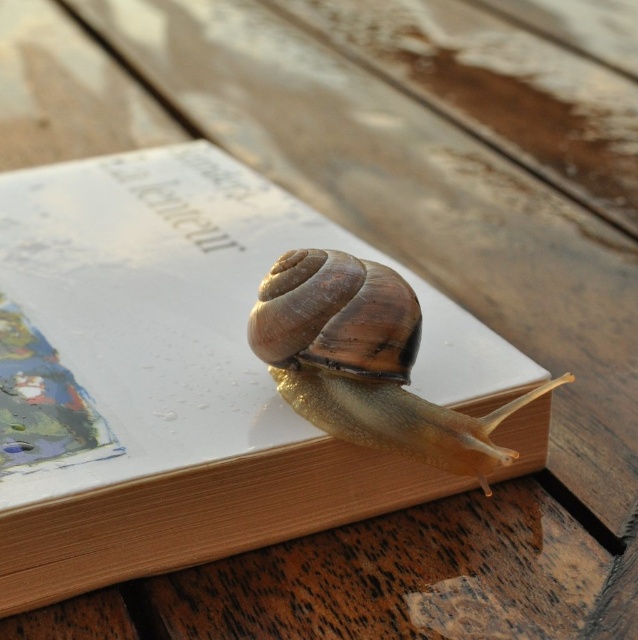
You are a small toy car that is 5 cm tall. You want to drive under the white paper book at center. Can you fit under it without touching the shiny brown shell at center?

The white paper book at center is much taller than the shiny brown shell at center. Since the toy car is 5 cm tall, and the book is much taller, there should be enough space for the car to drive under the book without touching the shell.

You have a small toy car that is 10 centimeters long. You want to place it on the wooden surface next to the white paper book at center and the shiny brown shell at center. Can the toy car fit horizontally between the two objects without overlapping them?

The white paper book at center might be wider than the shiny brown shell at center, so the toy car may or may not fit depending on the exact width of the book. However, since the book is at the center and the shell is also at the center, their positions might be close, making it uncertain if there is enough space for the 10 cm toy car between them.